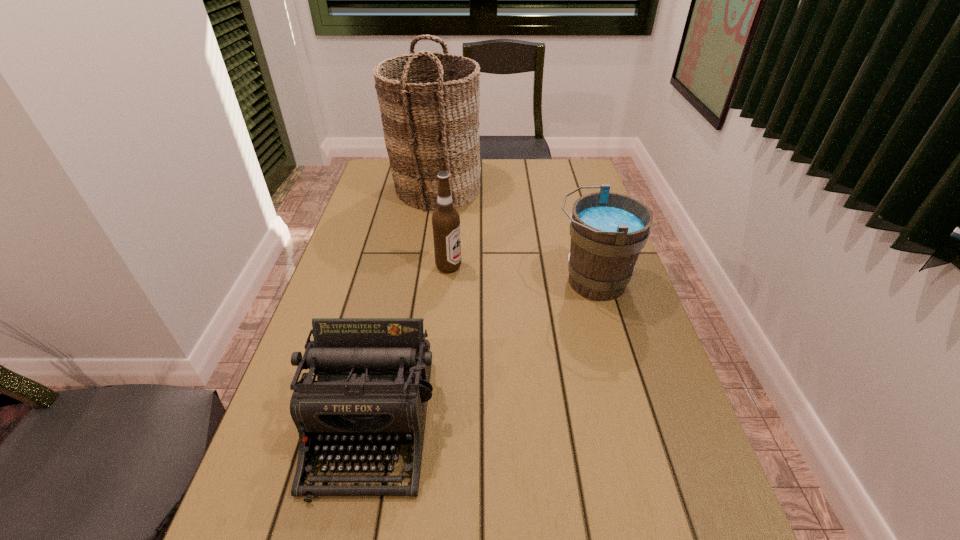
You are a GUI agent. You are given a task and a screenshot of the screen. Output one action in this format:
    pyautogui.click(x=<x>, y=<y>)
    Task: Click on the free space between the third tallest object and the typewriter
    Image resolution: width=960 pixels, height=540 pixels.
    Given the screenshot: What is the action you would take?
    pyautogui.click(x=482, y=352)

At what (x,y) coordinates should I click in order to perform the action: click on unoccupied position between the typewriter and the farthest object. Please return your answer as a coordinate pair (x, y). Image resolution: width=960 pixels, height=540 pixels. Looking at the image, I should click on (403, 306).

What are the coordinates of `free area in between the wine bucket and the shortest object` in the screenshot? It's located at (482, 352).

Find the location of a particular element. free point between the nearest object and the tallest object is located at coordinates (403, 306).

Locate an element on the screen. This screenshot has height=540, width=960. free spot between the wine bucket and the alcohol is located at coordinates (520, 274).

Find the location of a particular element. vacant space that's between the rightmost object and the alcohol is located at coordinates (520, 274).

Select which object appears as the second closest to the alcohol. Please provide its 2D coordinates. Your answer should be formatted as a tuple, i.e. [(x, y)], where the tuple contains the x and y coordinates of a point satisfying the conditions above.

[(608, 230)]

Locate an element on the screen. Image resolution: width=960 pixels, height=540 pixels. object that is the second closest one to the tallest object is located at coordinates (608, 230).

Where is `free space that satisfies the following two spatial constraints: 1. with a handle on the side of the rightmost object; 2. on the keyboard of the typewriter`? The image size is (960, 540). free space that satisfies the following two spatial constraints: 1. with a handle on the side of the rightmost object; 2. on the keyboard of the typewriter is located at coordinates (633, 423).